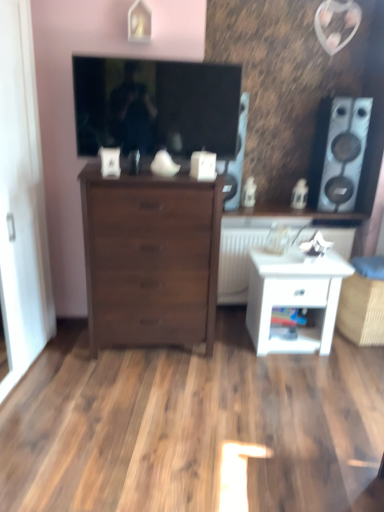
What do you see at coordinates (156, 105) in the screenshot? I see `matte black tv at upper center` at bounding box center [156, 105].

Measure the distance between dark wood chest of drawers at center and camera.

dark wood chest of drawers at center is 2.30 meters away from camera.

Identify the location of dark wood chest of drawers at center. (150, 258).

What is the approximate height of wooden cabinet at center?

The height of wooden cabinet at center is 1.72 inches.

Locate an element on the screen. The image size is (384, 512). wooden cabinet at center is located at coordinates (288, 216).

Where is `white glossy speaker at right, acting as the second speaker starting from the left`? The width and height of the screenshot is (384, 512). white glossy speaker at right, acting as the second speaker starting from the left is located at coordinates (339, 152).

Identify the location of white glossy nightstand at lower right. (294, 297).

Find the location of a particular element. This screenshot has height=512, width=384. matte black speaker at upper center, which is the second speaker in right-to-left order is located at coordinates (239, 153).

The image size is (384, 512). In order to click on matte black tv at upper center in this screenshot , I will do `click(156, 105)`.

Visually, is matte black tv at upper center positioned to the left or to the right of white glossy speaker at right, marked as the first speaker in a right-to-left arrangement?

matte black tv at upper center is to the left of white glossy speaker at right, marked as the first speaker in a right-to-left arrangement.

From the picture: Is matte black tv at upper center wider than white glossy speaker at right, marked as the first speaker in a right-to-left arrangement?

In fact, matte black tv at upper center might be narrower than white glossy speaker at right, marked as the first speaker in a right-to-left arrangement.

Considering the positions of points (218, 89) and (329, 121), is point (218, 89) closer to camera compared to point (329, 121)?

Yes.

Is matte black tv at upper center looking in the opposite direction of white glossy speaker at right, marked as the first speaker in a right-to-left arrangement?

No, white glossy speaker at right, marked as the first speaker in a right-to-left arrangement, is not at the back of matte black tv at upper center.

Considering the relative sizes of white matte radiator at center and wooden cabinet at center in the image provided, is white matte radiator at center thinner than wooden cabinet at center?

Incorrect, the width of white matte radiator at center is not less than that of wooden cabinet at center.

From their relative heights in the image, would you say white matte radiator at center is taller or shorter than wooden cabinet at center?

In the image, white matte radiator at center appears to be taller than wooden cabinet at center.

Is white matte radiator at center not near wooden cabinet at center?

That's not correct — white matte radiator at center is a little close to wooden cabinet at center.

Considering the relative positions of white matte radiator at center and wooden cabinet at center in the image provided, is white matte radiator at center to the right of wooden cabinet at center from the viewer's perspective?

No, white matte radiator at center is not to the right of wooden cabinet at center.

Which of these two, dark wood chest of drawers at center or wooden cabinet at center, is wider?

Wider between the two is wooden cabinet at center.

Could you tell me if dark wood chest of drawers at center is turned towards wooden cabinet at center?

No.

From a real-world perspective, is dark wood chest of drawers at center below wooden cabinet at center?

Yes, from a real-world perspective, dark wood chest of drawers at center is below wooden cabinet at center.

Can you tell me how much dark wood chest of drawers at center and wooden cabinet at center differ in facing direction?

0.92 degrees.

Could you tell me if dark wood chest of drawers at center is facing white glossy nightstand at lower right?

No.

Which is more to the right, dark wood chest of drawers at center or white glossy nightstand at lower right?

white glossy nightstand at lower right is more to the right.

Does dark wood chest of drawers at center have a greater height compared to white glossy nightstand at lower right?

Correct, dark wood chest of drawers at center is much taller as white glossy nightstand at lower right.

How different are the orientations of dark wood chest of drawers at center and white glossy nightstand at lower right in degrees?

The facing directions of dark wood chest of drawers at center and white glossy nightstand at lower right are 2.28 degrees apart.

From the image's perspective, which one is positioned higher, matte black tv at upper center or white glossy nightstand at lower right?

From the image's view, matte black tv at upper center is above.

This screenshot has width=384, height=512. Find the location of `nightstand below the matte black tv at upper center (from the image's perspective)`. nightstand below the matte black tv at upper center (from the image's perspective) is located at coordinates (294, 297).

Between matte black tv at upper center and white glossy nightstand at lower right, which one has smaller size?

matte black tv at upper center is smaller.

Between matte black tv at upper center and white glossy nightstand at lower right, which one appears on the right side from the viewer's perspective?

From the viewer's perspective, white glossy nightstand at lower right appears more on the right side.

From a real-world perspective, which is physically below, white glossy speaker at right, marked as the first speaker in a right-to-left arrangement, or matte black speaker at upper center, the 1th speaker when ordered from left to right?

matte black speaker at upper center, the 1th speaker when ordered from left to right.

Which of these two, white glossy speaker at right, marked as the first speaker in a right-to-left arrangement, or matte black speaker at upper center, the 1th speaker when ordered from left to right, stands shorter?

matte black speaker at upper center, the 1th speaker when ordered from left to right.

From the image's perspective, is white glossy speaker at right, acting as the second speaker starting from the left, positioned above or below matte black speaker at upper center, which is the second speaker in right-to-left order?

Clearly, from the image's perspective, white glossy speaker at right, acting as the second speaker starting from the left, is below matte black speaker at upper center, which is the second speaker in right-to-left order.

Is white glossy speaker at right, marked as the first speaker in a right-to-left arrangement, with matte black speaker at upper center, the 1th speaker when ordered from left to right?

No, white glossy speaker at right, marked as the first speaker in a right-to-left arrangement, is not making contact with matte black speaker at upper center, the 1th speaker when ordered from left to right.

Is white matte radiator at center oriented towards matte black tv at upper center?

No, white matte radiator at center is not oriented towards matte black tv at upper center.

Which is more to the right, white matte radiator at center or matte black tv at upper center?

white matte radiator at center.

Are white matte radiator at center and matte black tv at upper center far apart?

No, white matte radiator at center is in close proximity to matte black tv at upper center.

From the image's perspective, count 2nd speakers downward from the matte black tv at upper center and point to it. Please provide its 2D coordinates.

[(339, 152)]

Where is `counter top above the white matte radiator at center (from a real-world perspective)`? This screenshot has height=512, width=384. counter top above the white matte radiator at center (from a real-world perspective) is located at coordinates (288, 216).

Looking at the image, which one is located closer to white matte radiator at center, white glossy nightstand at lower right or white glossy speaker at right, acting as the second speaker starting from the left?

white glossy nightstand at lower right.

When comparing their distances from matte black tv at upper center, does white glossy nightstand at lower right or wooden cabinet at center seem further?

white glossy nightstand at lower right is positioned further to the anchor matte black tv at upper center.

Looking at the image, which one is located further to wooden cabinet at center, white matte radiator at center or matte black speaker at upper center, which is the second speaker in right-to-left order?

The object further to wooden cabinet at center is matte black speaker at upper center, which is the second speaker in right-to-left order.

Considering their positions, is white matte radiator at center positioned closer to white glossy speaker at right, acting as the second speaker starting from the left, than wooden cabinet at center?

Among the two, wooden cabinet at center is located nearer to white glossy speaker at right, acting as the second speaker starting from the left.

Estimate the real-world distances between objects in this image. Which object is closer to white glossy speaker at right, marked as the first speaker in a right-to-left arrangement, dark wood chest of drawers at center or matte black speaker at upper center, the 1th speaker when ordered from left to right?

The object closer to white glossy speaker at right, marked as the first speaker in a right-to-left arrangement, is matte black speaker at upper center, the 1th speaker when ordered from left to right.

Based on the photo, estimate the real-world distances between objects in this image. Which object is further from matte black tv at upper center, white matte radiator at center or dark wood chest of drawers at center?

white matte radiator at center.

From the image, which object appears to be farther from wooden cabinet at center, white matte radiator at center or dark wood chest of drawers at center?

dark wood chest of drawers at center is positioned further to the anchor wooden cabinet at center.

When comparing their distances from dark wood chest of drawers at center, does white glossy nightstand at lower right or white matte radiator at center seem closer?

white glossy nightstand at lower right is positioned closer to the anchor dark wood chest of drawers at center.

The width and height of the screenshot is (384, 512). What are the coordinates of `counter top that lies between matte black tv at upper center and white glossy nightstand at lower right from top to bottom` in the screenshot? It's located at (288, 216).

Find the location of a particular element. This screenshot has width=384, height=512. counter top between matte black speaker at upper center, which is the second speaker in right-to-left order, and white glossy nightstand at lower right in the up-down direction is located at coordinates (288, 216).

Locate an element on the screen. counter top between white glossy speaker at right, acting as the second speaker starting from the left, and white glossy nightstand at lower right in the up-down direction is located at coordinates click(288, 216).

In order to click on radiator located between dark wood chest of drawers at center and white glossy speaker at right, acting as the second speaker starting from the left, in the left-right direction in this screenshot , I will do `click(237, 262)`.